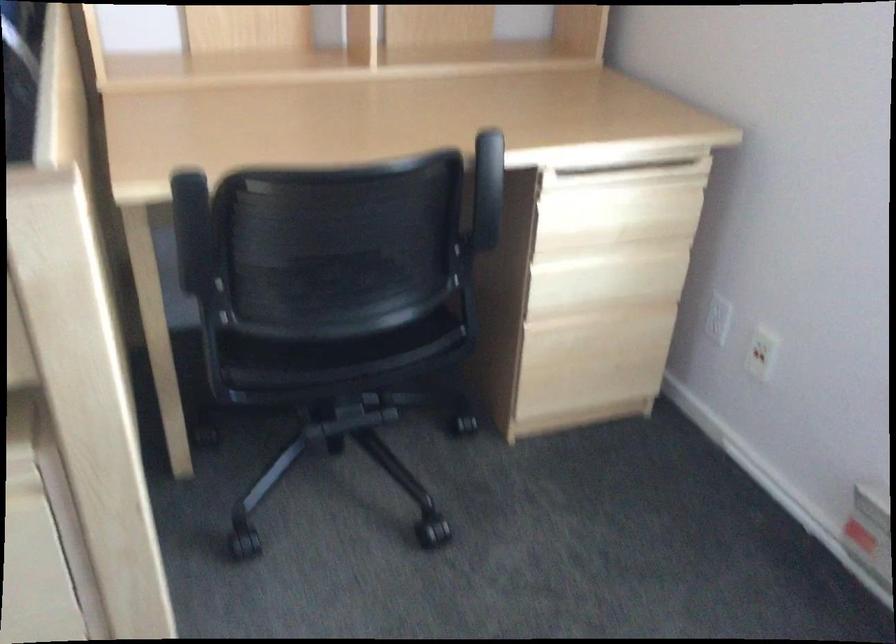
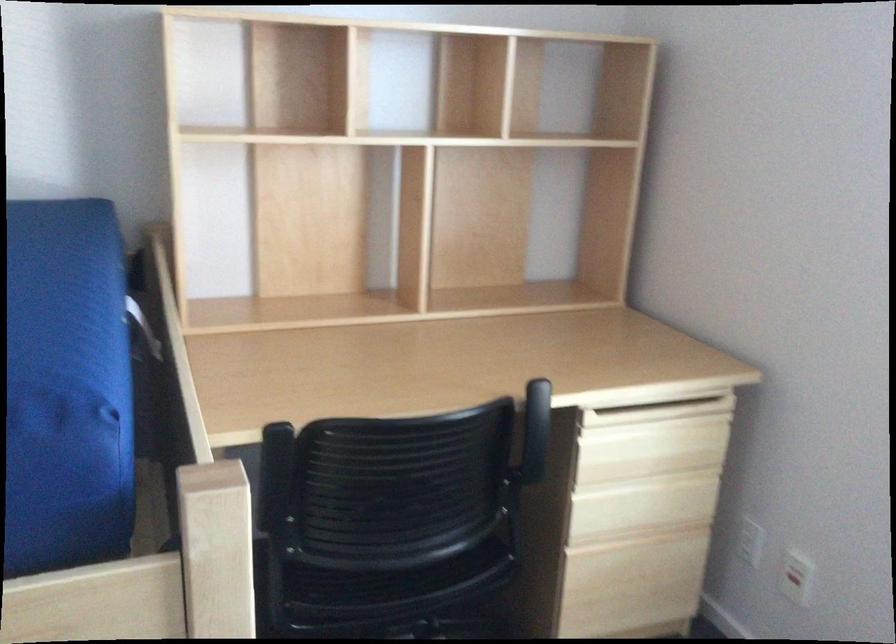
Question: The images are taken continuously from a first-person perspective. In which direction is your viewpoint rotating?

Choices:
 (A) Left
 (B) Right
 (C) Up
 (D) Down

Answer: (C)